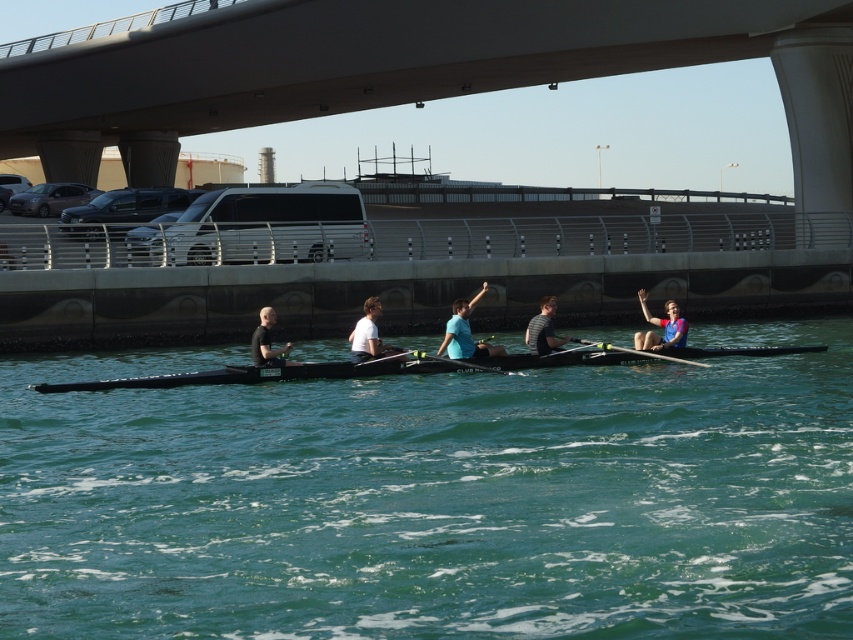
You are a photographer planning to capture a wide shot of the rowers. Given that the blue fabric rower at right and the black matte rower at center have different widths, which rower would require a smaller area in your camera frame to capture fully?

The blue fabric rower at right has a lesser width compared to the black matte rower at center, so it would require a smaller area in the camera frame to capture fully.

You are a photographer positioned at the origin point of the image. You want to capture a closeup shot of the matte blue shirt at center. Which direction should you move your camera to focus on it?

The matte blue shirt at center is located at coordinates point (465,332). Since the origin point is typically the bottom left corner of the image, moving the camera towards the upper right direction would position it closer to the shirt.